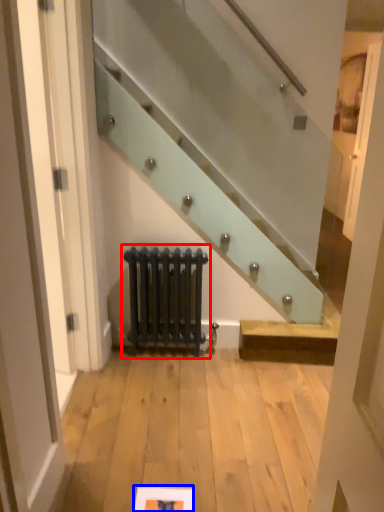
Question: Among these objects, which one is farthest to the camera, radiator (highlighted by a red box) or picture frame (highlighted by a blue box)?

Choices:
 (A) radiator
 (B) picture frame

Answer: (A)